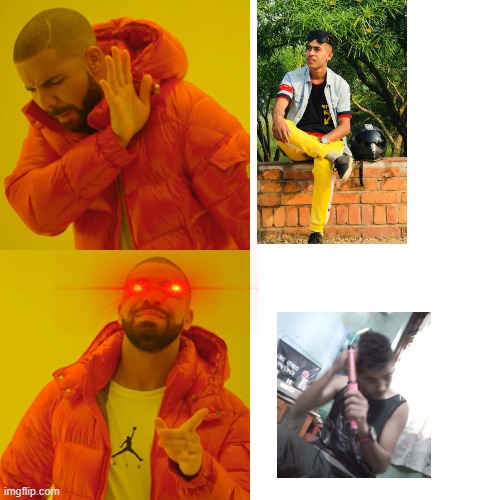
I want to click on brick wall, so click(x=349, y=225), click(x=286, y=220).